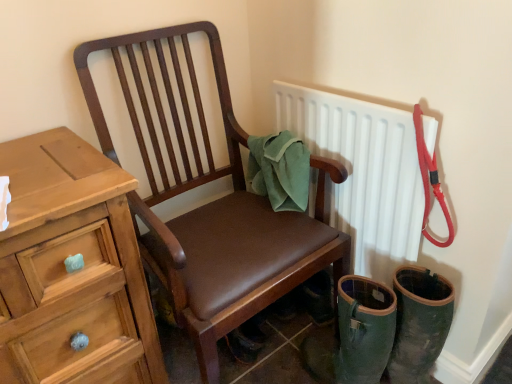
Where is `free point above wooden chest of drawers at left (from a real-world perspective)`? The height and width of the screenshot is (384, 512). free point above wooden chest of drawers at left (from a real-world perspective) is located at coordinates (40, 164).